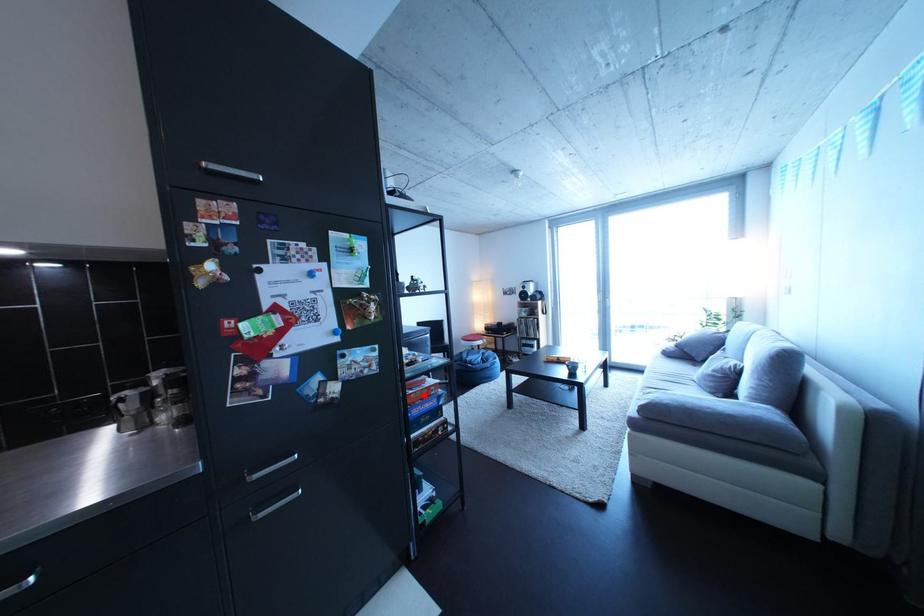
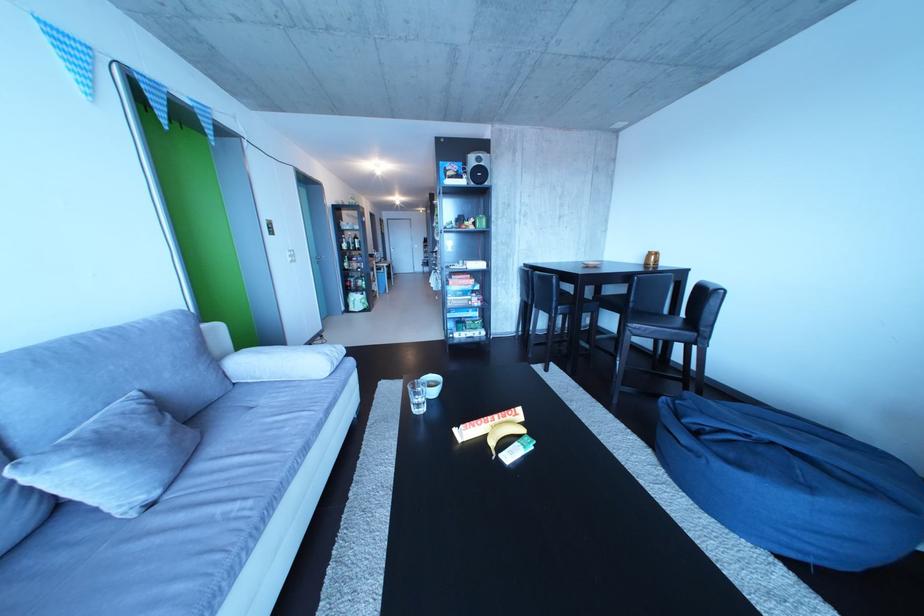
Question: I am providing you with two images of the same scene from different viewpoints. A red point is marked on the first image. Can you still see the location of the red point in image 2?

Choices:
 (A) Yes
 (B) No

Answer: (B)